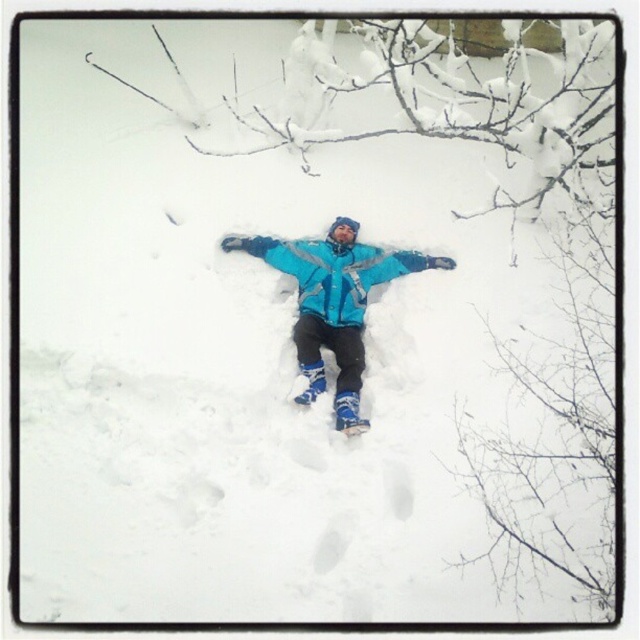
Which is behind, point (317, 244) or point (422, 269)?

The point (422, 269) is behind.

Is point (336, 227) positioned after point (349, 312)?

Yes, point (336, 227) is behind point (349, 312).

Image resolution: width=640 pixels, height=640 pixels. Describe the element at coordinates (333, 301) in the screenshot. I see `blue matte jacket at center` at that location.

In order to click on blue matte jacket at center in this screenshot , I will do `click(333, 301)`.